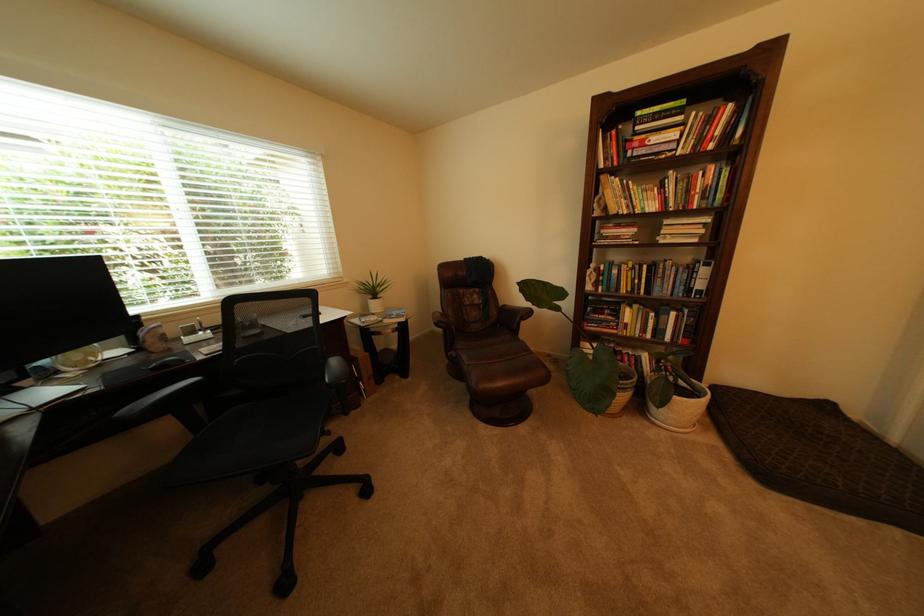
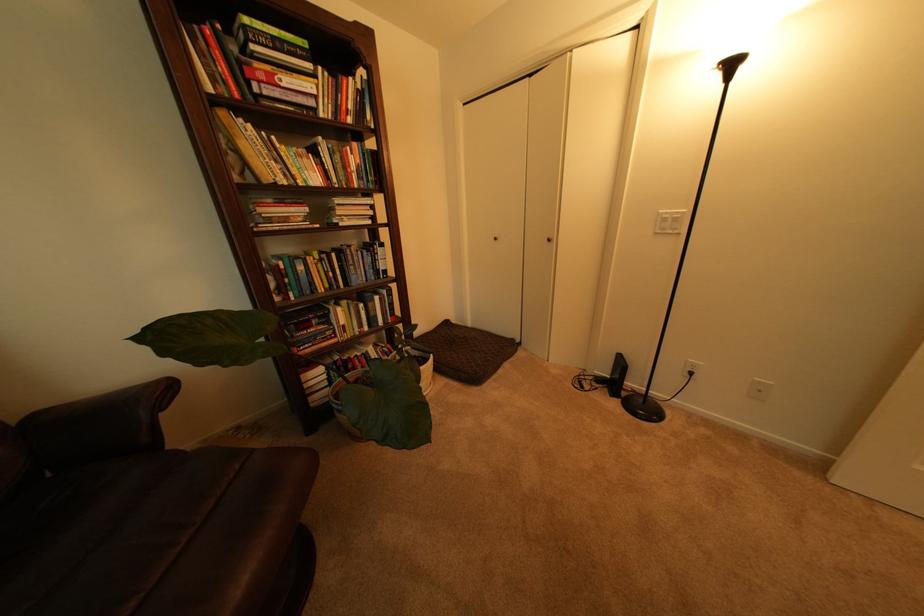
Question: The camera is either moving clockwise (left) or counter-clockwise (right) around the object. The first image is from the beginning of the video and the second image is from the end. Is the camera moving left or right when shooting the video?

Choices:
 (A) Left
 (B) Right

Answer: (A)